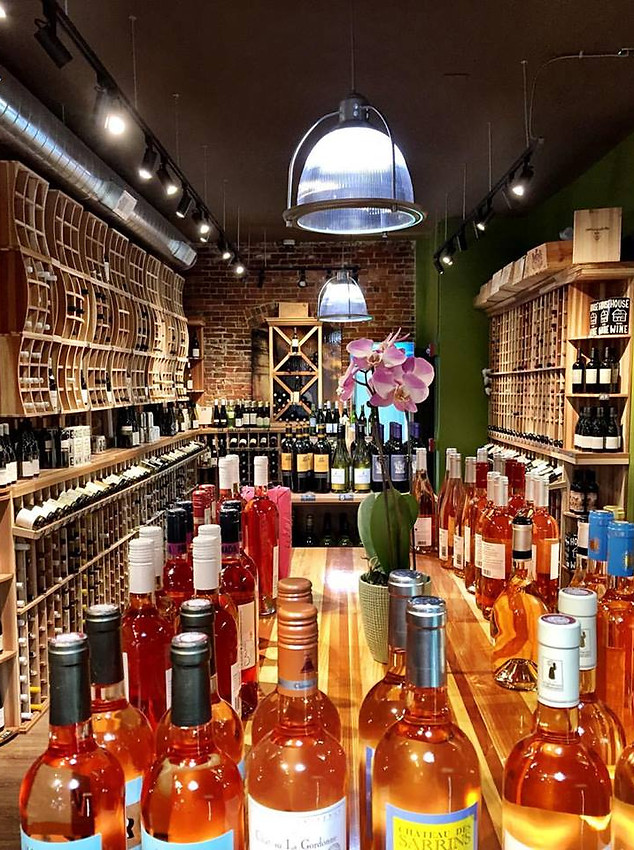
At what (x,y) coordinates should I click in order to perform the action: click on curvy wood shelves holding wine bottles. Please return your answer as a coordinate pair (x, y). Looking at the image, I should click on (68, 242), (73, 323), (75, 371).